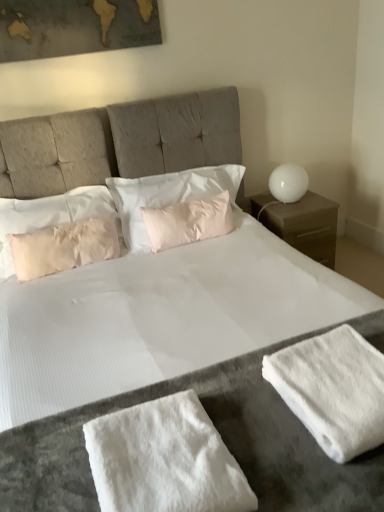
The image size is (384, 512). I want to click on vacant space behind white fluffy towel at lower center, so click(195, 385).